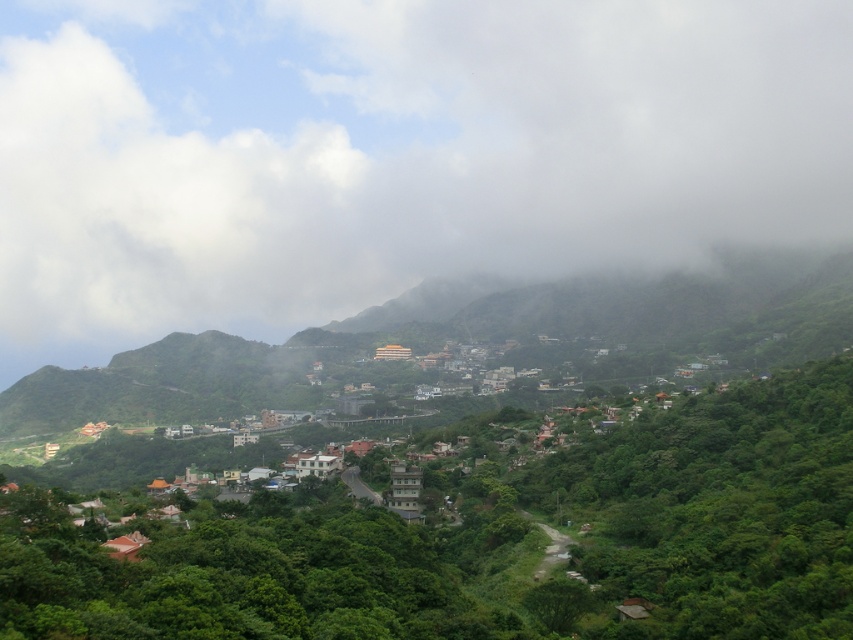
You are a drone operator flying a drone with a camera. You want to capture a photo of the white fluffy cloud at upper center. The drone is currently at the point with coordinates point (393, 154). Is the drone already positioned directly above the white fluffy cloud at upper center?

Yes, the drone is already positioned directly above the white fluffy cloud at upper center because the point (393, 154) indicates the location of the white fluffy cloud at upper center.

You are standing in the lush green landscape and want to walk from the point at coordinates point (x=84, y=13) to the point at coordinates point (x=283, y=410). Which direction should you move to get closer to your destination?

You should move away from the camera because point (x=84, y=13) is further to the camera than point (x=283, y=410). Moving away from the camera will take you towards the destination.

What are the coordinates of the white fluffy cloud at upper center in the image?

The white fluffy cloud at upper center is located at coordinates point [393,154].